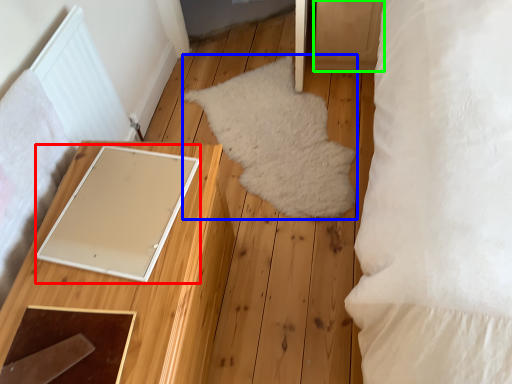
Question: Estimate the real-world distances between objects in this image. Which object is farther from pad (highlighted by a red box), mat (highlighted by a blue box) or drawer (highlighted by a green box)?

Choices:
 (A) mat
 (B) drawer

Answer: (B)